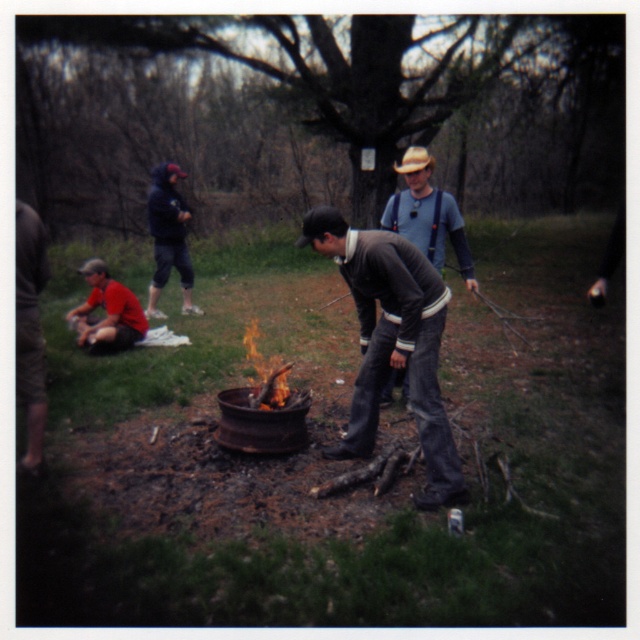
You are organizing a group photo and need to arrange the matte blue shirt at center and the dark blue hoodie at upper left in a row. Which clothing item should be placed on the left side to ensure the row is arranged from thinnest to thickest?

The matte blue shirt at center should be placed on the left side because it is thinner than the dark blue hoodie at upper left, making the row arranged from thinnest to thickest.

You are standing at the point labeled as point (392, 340) in the image. Looking around, you see dark gray jeans at center and a fire pit with flames. What object is directly beneath your feet?

The point labeled as point (392, 340) is located on the dark gray jeans at center, so the object directly beneath your feet is the dark gray jeans at center.